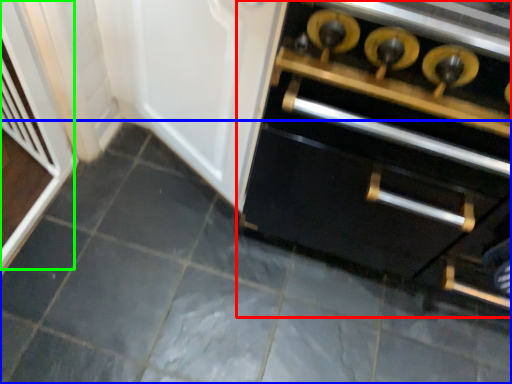
Question: Which object is the closest to the cabinetry (highlighted by a red box)? Choose among these: ceramic tile (highlighted by a blue box) or screen door (highlighted by a green box).

Choices:
 (A) ceramic tile
 (B) screen door

Answer: (A)